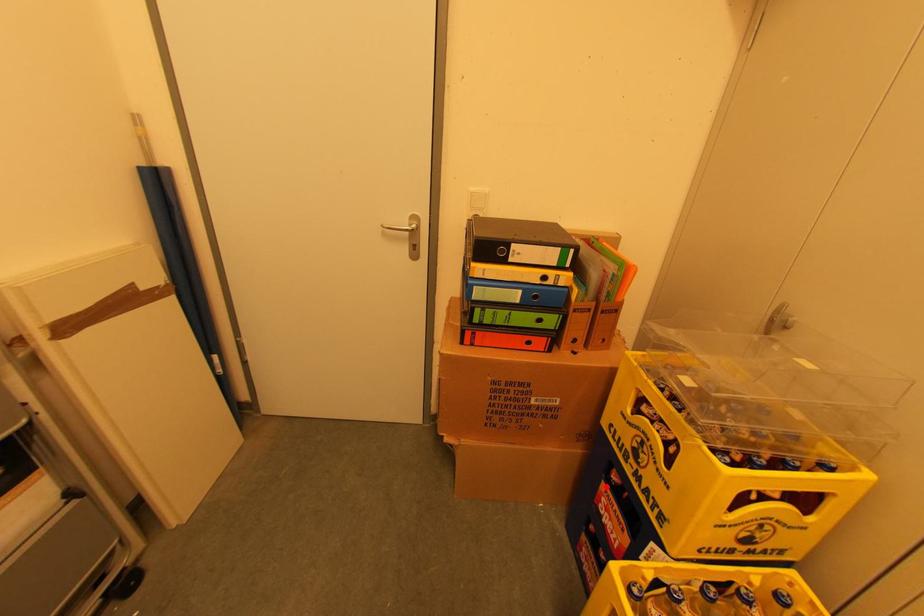
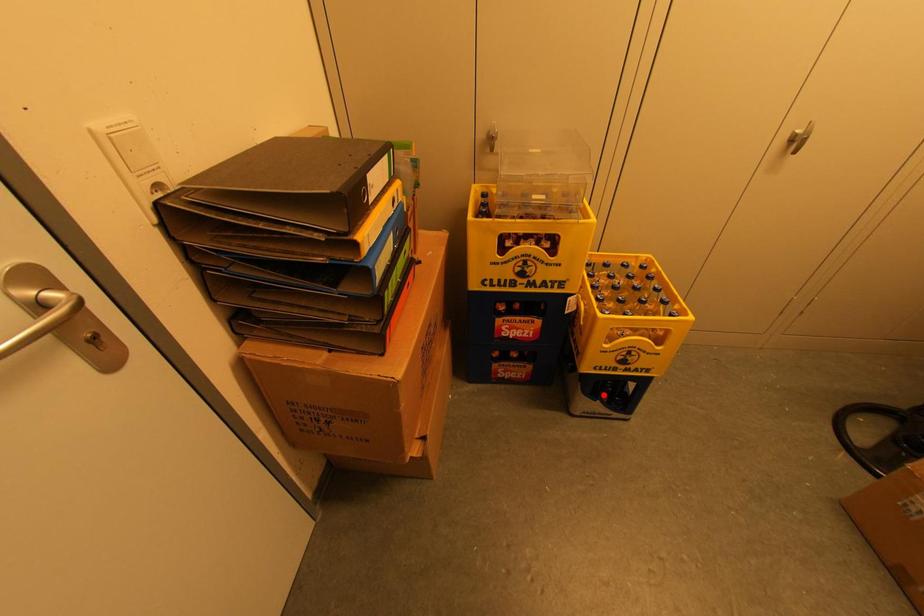
I am providing you with two images of the same scene from different viewpoints. A red point is marked on the first image and another point is marked on the second image. Do the highlighted points in image1 and image2 indicate the same real-world spot?

No